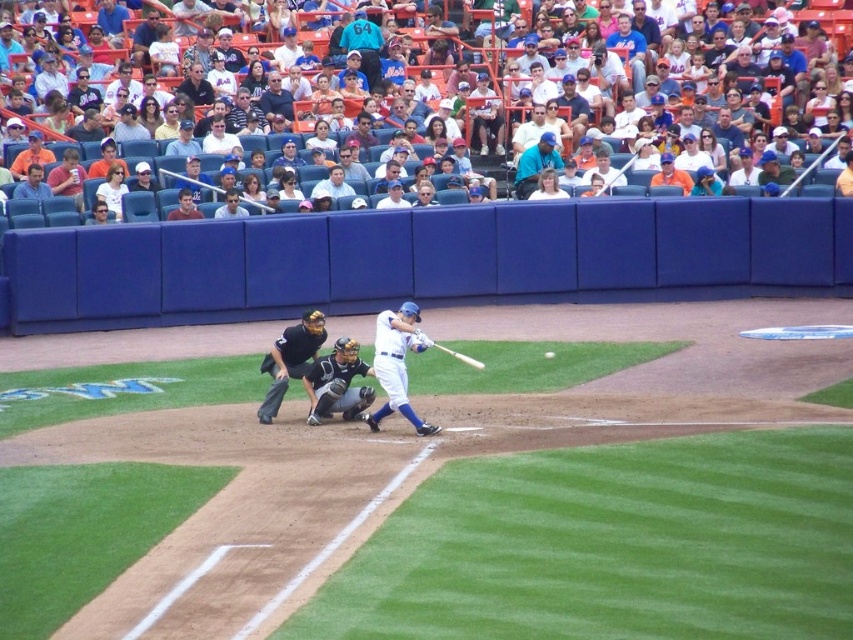
You are a photographer standing at the edge of the field. You want to take a photo of both point [537,147] and point [345,385] in the image. Which point should you focus on first to ensure both are in sharp focus?

You should focus on point [537,147] first because it is closer to the camera than point [345,385]. By focusing on the closer point, the farther point will also be within the depth of field and in focus.

You are a sports analyst watching the game. You notice the wooden baseball bat at center and the brown leather glove at center. Which object is taller?

The wooden baseball bat at center is taller than the brown leather glove at center.